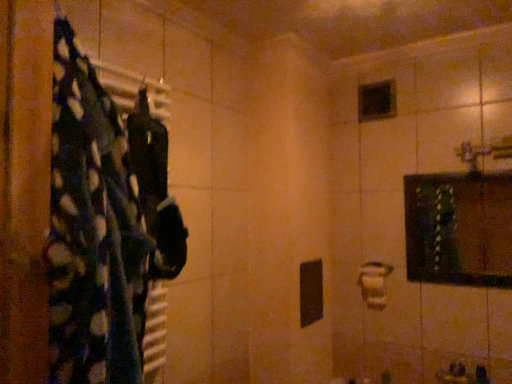
Question: Can you confirm if black fabric at left is shorter than wooden framed mirror at upper right?

Choices:
 (A) no
 (B) yes

Answer: (A)

Question: Considering the relative positions of black fabric at left and wooden framed mirror at upper right in the image provided, is black fabric at left behind wooden framed mirror at upper right?

Choices:
 (A) no
 (B) yes

Answer: (A)

Question: Is black fabric at left thinner than wooden framed mirror at upper right?

Choices:
 (A) no
 (B) yes

Answer: (A)

Question: From the image's perspective, is black fabric at left on wooden framed mirror at upper right?

Choices:
 (A) yes
 (B) no

Answer: (A)

Question: Considering the relative positions of black fabric at left and wooden framed mirror at upper right in the image provided, is black fabric at left to the right of wooden framed mirror at upper right from the viewer's perspective?

Choices:
 (A) no
 (B) yes

Answer: (A)

Question: Can wooden framed mirror at upper right be found inside black fabric at left?

Choices:
 (A) no
 (B) yes

Answer: (A)

Question: From a real-world perspective, is wooden framed mirror at upper right positioned over black glass mirror at upper center based on gravity?

Choices:
 (A) no
 (B) yes

Answer: (A)

Question: Can you confirm if wooden framed mirror at upper right is smaller than black glass mirror at upper center?

Choices:
 (A) yes
 (B) no

Answer: (B)

Question: Is the surface of wooden framed mirror at upper right in direct contact with black glass mirror at upper center?

Choices:
 (A) yes
 (B) no

Answer: (B)

Question: From the image's perspective, does wooden framed mirror at upper right appear higher than black glass mirror at upper center?

Choices:
 (A) yes
 (B) no

Answer: (B)

Question: Is wooden framed mirror at upper right bigger than black glass mirror at upper center?

Choices:
 (A) no
 (B) yes

Answer: (B)

Question: Considering the relative positions of wooden framed mirror at upper right and black glass mirror at upper center in the image provided, is wooden framed mirror at upper right to the left of black glass mirror at upper center from the viewer's perspective?

Choices:
 (A) no
 (B) yes

Answer: (A)

Question: From a real-world perspective, is black glass mirror at upper center under black fabric at left?

Choices:
 (A) yes
 (B) no

Answer: (B)